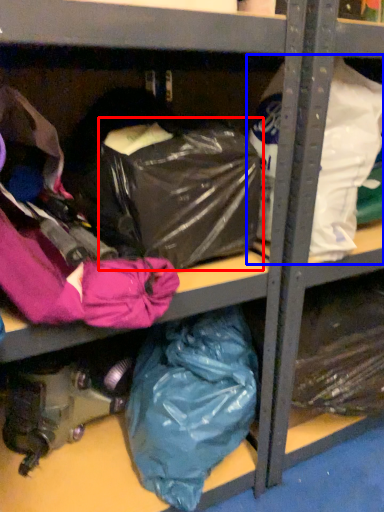
Question: Which point is further to the camera, bag (highlighted by a red box) or plastic bag (highlighted by a blue box)?

Choices:
 (A) bag
 (B) plastic bag

Answer: (B)